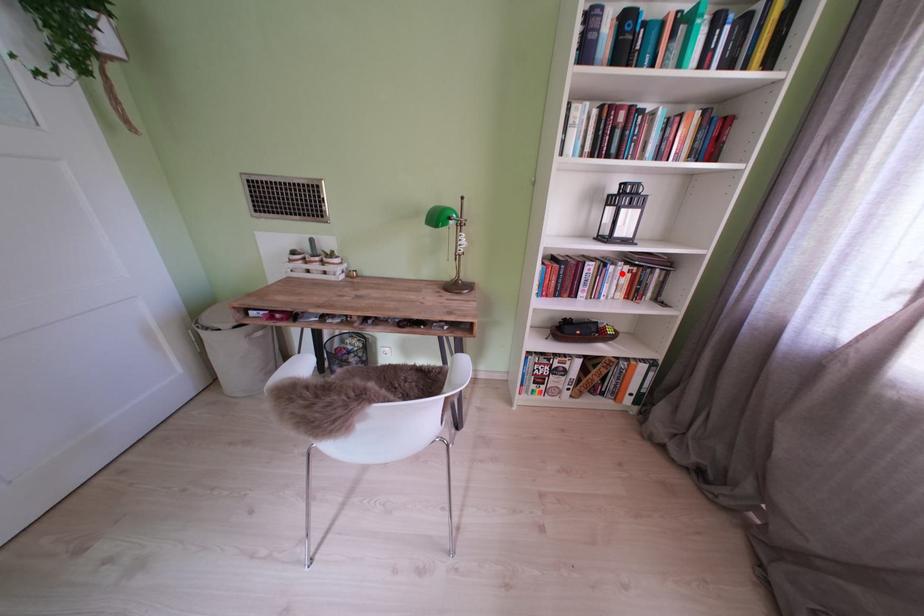
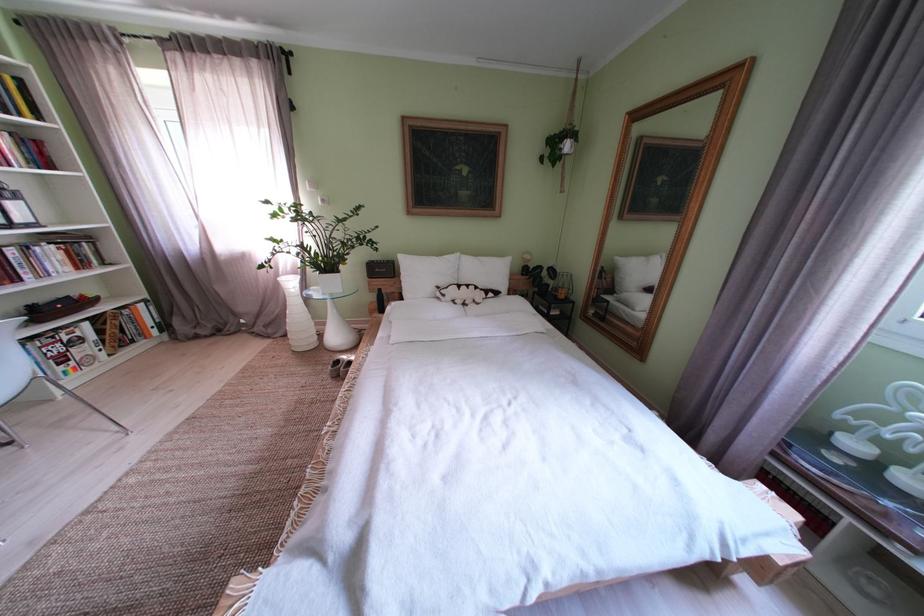
The point at the highlighted location is marked in the first image. Where is the corresponding point in the second image?

(49, 254)